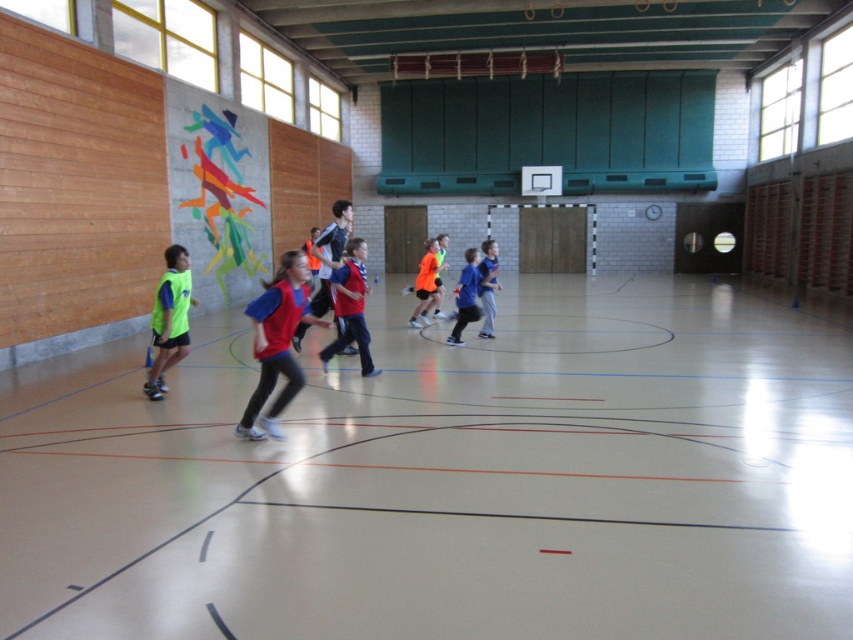
Which is more to the right, blue fabric shirt at center or orange matte jersey at center?

blue fabric shirt at center

Which of these two, blue fabric shirt at center or orange matte jersey at center, stands shorter?

With less height is orange matte jersey at center.

Is point (469, 301) positioned before point (434, 301)?

Yes, it is.

Identify the location of blue fabric shirt at center. (466, 296).

Who is more distant from viewer, (465, 269) or (494, 288)?

The point (494, 288) is more distant.

At what (x,y) coordinates should I click in order to perform the action: click on blue fabric shirt at center. Please return your answer as a coordinate pair (x, y). Looking at the image, I should click on (466, 296).

Identify the location of blue fabric shirt at center. (466, 296).

Between neon yellow jersey at left and matte red jersey at center, which one has less height?

neon yellow jersey at left is shorter.

Who is more distant from viewer, (x=163, y=332) or (x=363, y=333)?

The point (x=363, y=333) is behind.

The image size is (853, 640). I want to click on neon yellow jersey at left, so click(169, 317).